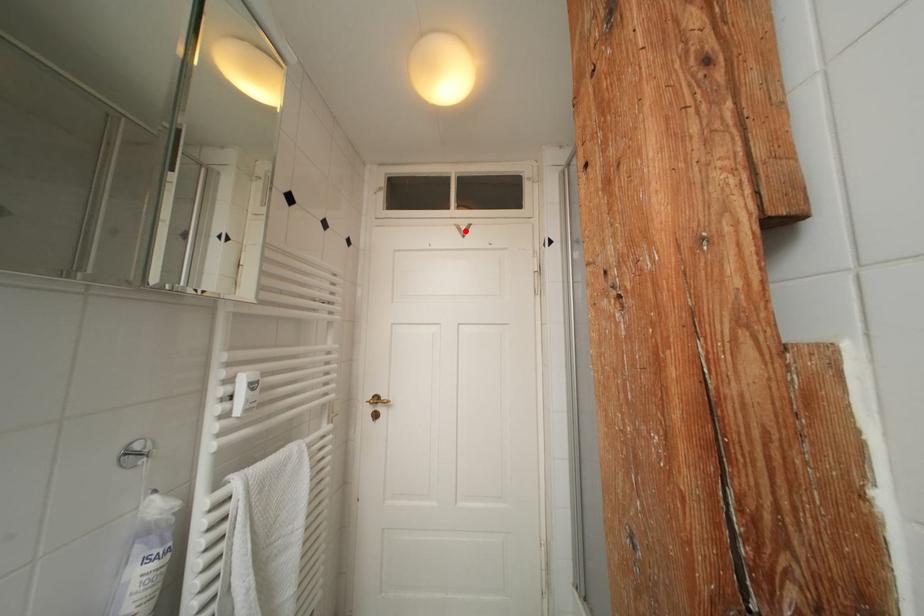
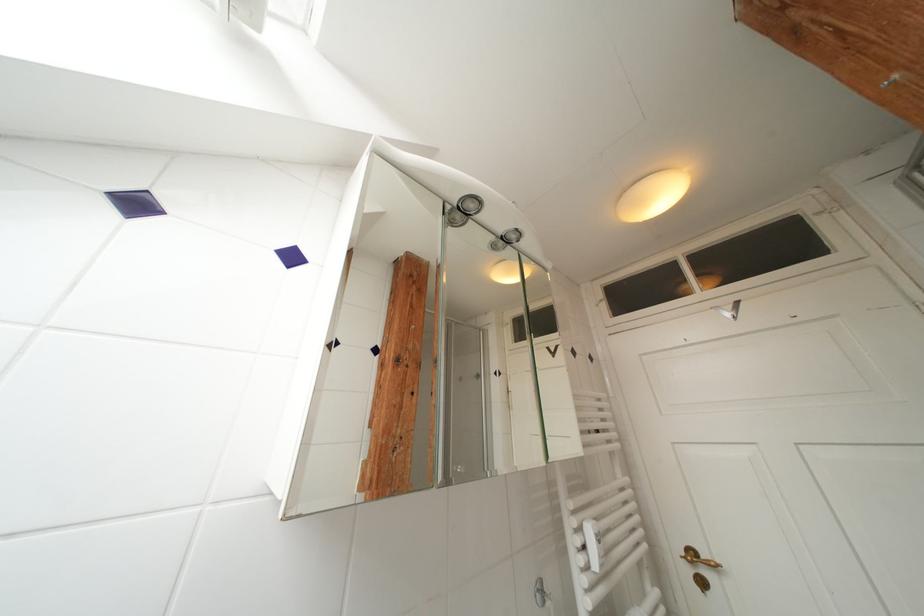
Where in the second image is the point corresponding to the highlighted location from the first image?

(724, 312)